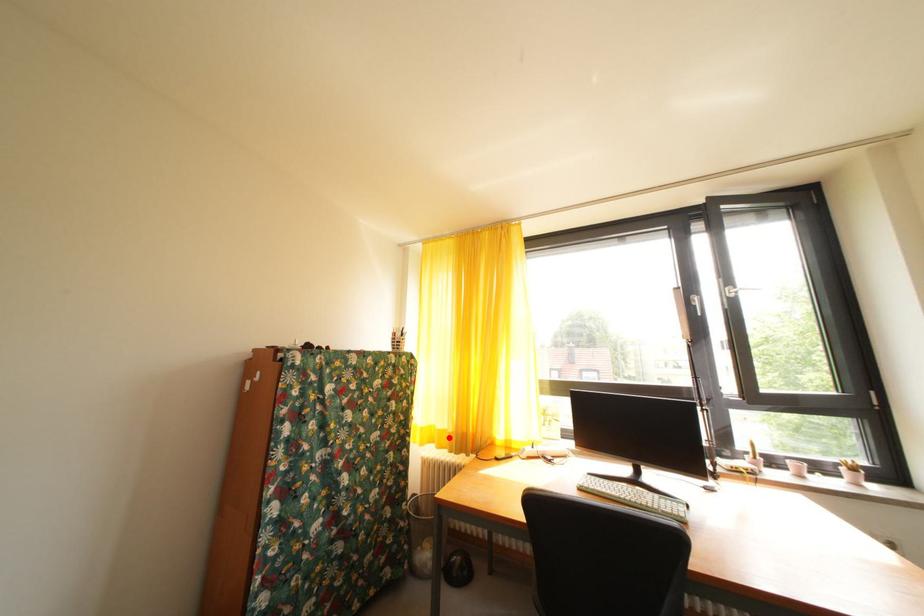
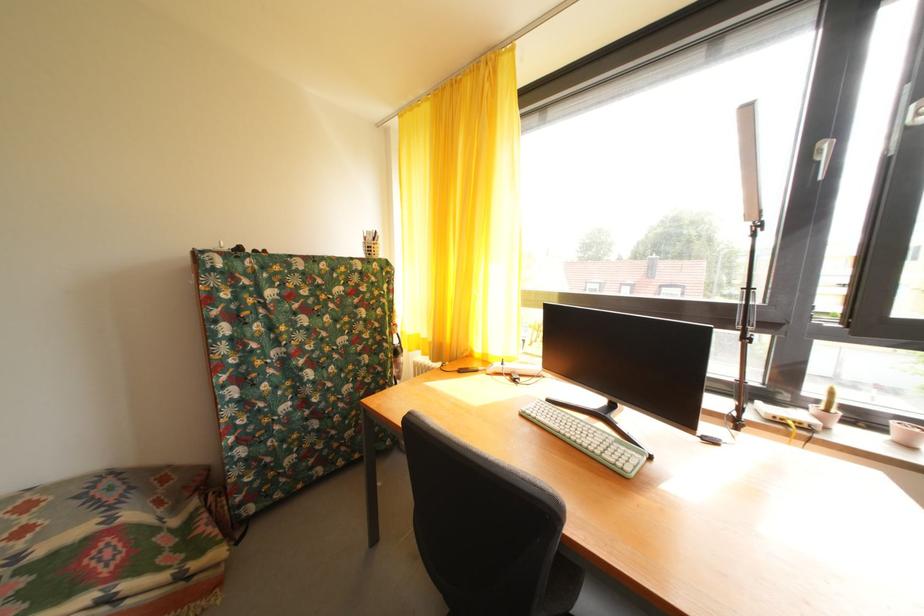
Locate, in the second image, the point that corresponds to the highlighted location in the first image.

(432, 346)